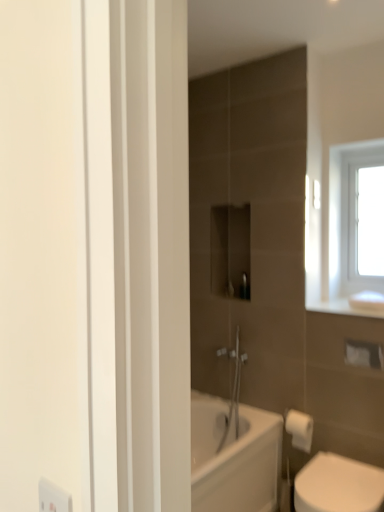
Question: Is the depth of white matte toilet paper at lower right less than that of white glass window at upper right?

Choices:
 (A) no
 (B) yes

Answer: (B)

Question: Does white matte toilet paper at lower right have a greater height compared to white glass window at upper right?

Choices:
 (A) yes
 (B) no

Answer: (B)

Question: Does white matte toilet paper at lower right have a lesser height compared to white glass window at upper right?

Choices:
 (A) no
 (B) yes

Answer: (B)

Question: Is white matte toilet paper at lower right further to the viewer compared to white glass window at upper right?

Choices:
 (A) yes
 (B) no

Answer: (B)

Question: Can we say white matte toilet paper at lower right lies outside white glass window at upper right?

Choices:
 (A) no
 (B) yes

Answer: (B)

Question: Considering the relative positions of white glass window at upper right and white matte toilet paper at lower right in the image provided, is white glass window at upper right to the left or to the right of white matte toilet paper at lower right?

Choices:
 (A) right
 (B) left

Answer: (A)

Question: In terms of width, does white glass window at upper right look wider or thinner when compared to white matte toilet paper at lower right?

Choices:
 (A) wide
 (B) thin

Answer: (B)

Question: Considering the positions of point (370, 159) and point (306, 433), is point (370, 159) closer or farther from the camera than point (306, 433)?

Choices:
 (A) closer
 (B) farther

Answer: (B)

Question: From the image's perspective, is white glass window at upper right above or below white matte toilet paper at lower right?

Choices:
 (A) above
 (B) below

Answer: (A)

Question: Relative to white glossy toilet at lower right, is white matte toilet paper at lower right in front or behind?

Choices:
 (A) front
 (B) behind

Answer: (B)

Question: Considering the relative positions of white matte toilet paper at lower right and white glossy toilet at lower right in the image provided, is white matte toilet paper at lower right to the left or to the right of white glossy toilet at lower right?

Choices:
 (A) right
 (B) left

Answer: (B)

Question: Is point (299, 419) positioned closer to the camera than point (334, 508)?

Choices:
 (A) closer
 (B) farther

Answer: (B)

Question: Is white matte toilet paper at lower right wider or thinner than white glossy toilet at lower right?

Choices:
 (A) wide
 (B) thin

Answer: (B)

Question: Looking at the image, does white matte toilet paper at lower right seem bigger or smaller compared to white glass window at upper right?

Choices:
 (A) big
 (B) small

Answer: (B)

Question: Relative to white glass window at upper right, is white matte toilet paper at lower right in front or behind?

Choices:
 (A) behind
 (B) front

Answer: (B)